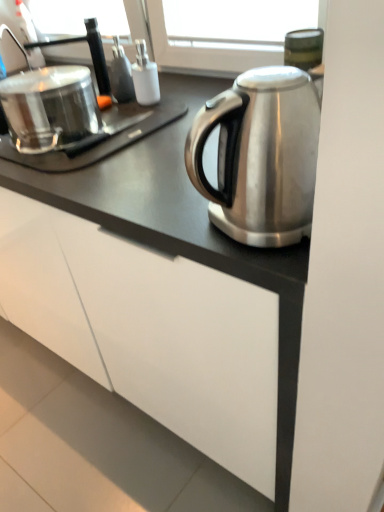
Question: Does shiny metallic pot at left turn towards brushed metal faucet at upper left?

Choices:
 (A) no
 (B) yes

Answer: (A)

Question: From a real-world perspective, does shiny metallic pot at left stand above brushed metal faucet at upper left?

Choices:
 (A) no
 (B) yes

Answer: (A)

Question: Considering the relative sizes of shiny metallic pot at left and brushed metal faucet at upper left in the image provided, is shiny metallic pot at left wider than brushed metal faucet at upper left?

Choices:
 (A) yes
 (B) no

Answer: (A)

Question: Is shiny metallic pot at left at the right side of brushed metal faucet at upper left?

Choices:
 (A) no
 (B) yes

Answer: (B)

Question: Is shiny metallic pot at left not near brushed metal faucet at upper left?

Choices:
 (A) yes
 (B) no

Answer: (B)

Question: Considering the relative sizes of shiny metallic pot at left and brushed metal faucet at upper left in the image provided, is shiny metallic pot at left smaller than brushed metal faucet at upper left?

Choices:
 (A) no
 (B) yes

Answer: (A)

Question: Does brushed metal faucet at upper left appear on the right side of shiny metallic pot at left?

Choices:
 (A) no
 (B) yes

Answer: (A)

Question: From a real-world perspective, does brushed metal faucet at upper left stand above shiny metallic pot at left?

Choices:
 (A) no
 (B) yes

Answer: (B)

Question: Does brushed metal faucet at upper left contain shiny metallic pot at left?

Choices:
 (A) yes
 (B) no

Answer: (B)

Question: Is brushed metal faucet at upper left far from shiny metallic pot at left?

Choices:
 (A) yes
 (B) no

Answer: (B)

Question: Is brushed metal faucet at upper left looking in the opposite direction of shiny metallic pot at left?

Choices:
 (A) yes
 (B) no

Answer: (B)

Question: Is brushed metal faucet at upper left next to shiny metallic pot at left?

Choices:
 (A) yes
 (B) no

Answer: (B)

Question: Does shiny metallic pot at left have a smaller size compared to white matte cabinet at lower center?

Choices:
 (A) yes
 (B) no

Answer: (A)